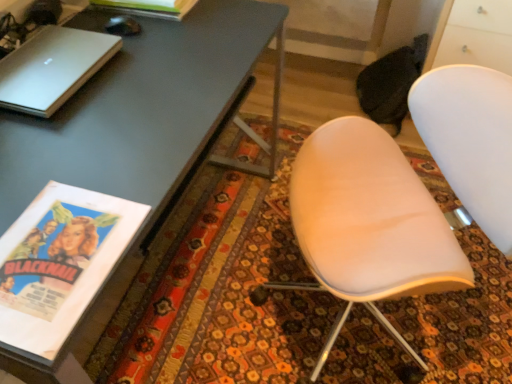
You are a GUI agent. You are given a task and a screenshot of the screen. Output one action in this format:
    pyautogui.click(x=<x>, y=<y>)
    Task: Click on the vacant area that is in front of silver metallic laptop at upper left
    
    Given the screenshot: What is the action you would take?
    58,143